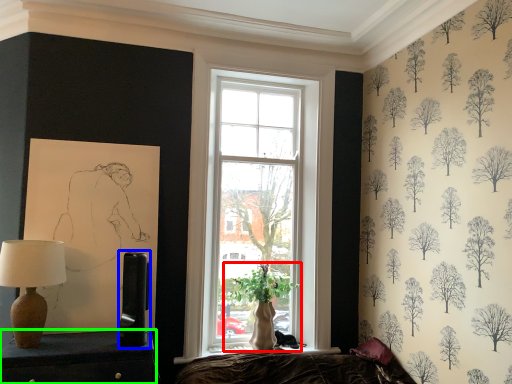
Question: Estimate the real-world distances between objects in this image. Which object is farther from houseplant (highlighted by a red box), table lamp (highlighted by a blue box) or furniture (highlighted by a green box)?

Choices:
 (A) table lamp
 (B) furniture

Answer: (B)